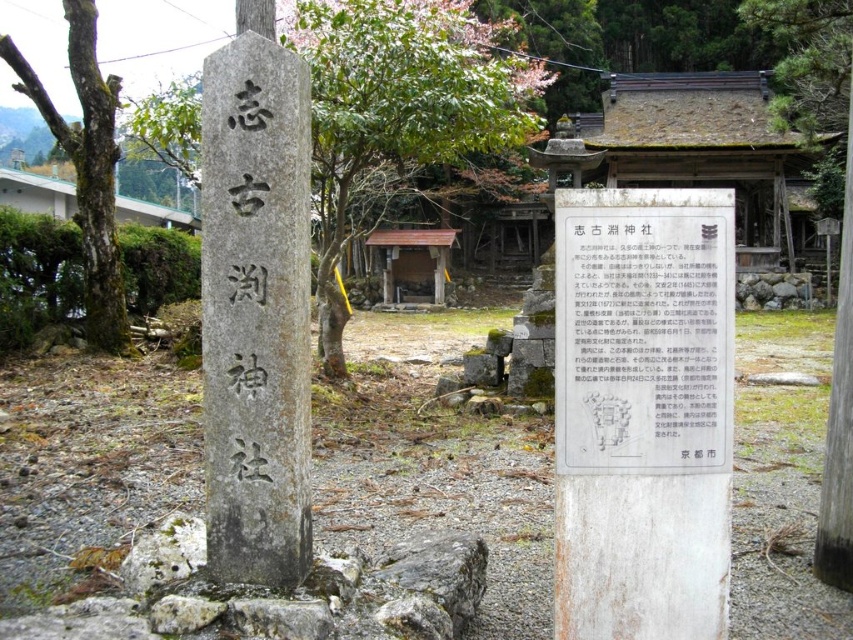
You are a visitor at the shrine and want to take a photo that includes both the gray stone monument at center and the smooth bark tree at left. If your camera can capture a maximum distance of 9 meters between the closest and farthest objects in the frame, will you be able to include both in the same photo?

The gray stone monument at center and smooth bark tree at left are 9.07 meters apart from each other. Since the camera can only capture up to 9 meters, the distance between them is slightly too far, so both cannot be included in the same photo.

You are standing in front of a traditional Japanese shrine. You want to take a photo of the gray stone monument at center. If your camera can focus on objects up to 3 meters away, will it be able to capture the monument clearly?

The gray stone monument at center is 2.61 meters away from the viewer, so yes, the camera can focus on it since the distance is within the 3 meters range.

You are a tourist holding a 10 meter long measuring tape. You want to measure the distance between the white paper sign at center and the smooth bark tree at left. Will your measuring tape be long enough?

The distance between the white paper sign at center and the smooth bark tree at left is 9.74 meters. Since your measuring tape is 10 meters long, it will be long enough to measure the distance between the white paper sign at center and the smooth bark tree at left.